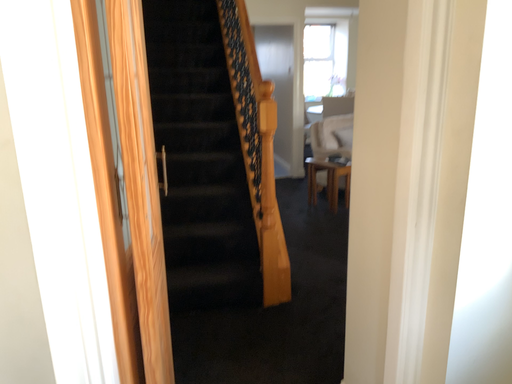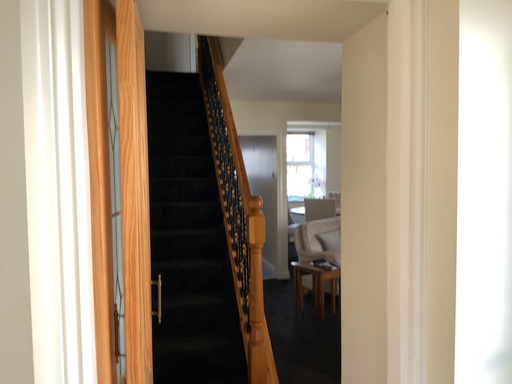
Question: How did the camera likely rotate when shooting the video?

Choices:
 (A) rotated upward
 (B) rotated downward

Answer: (A)